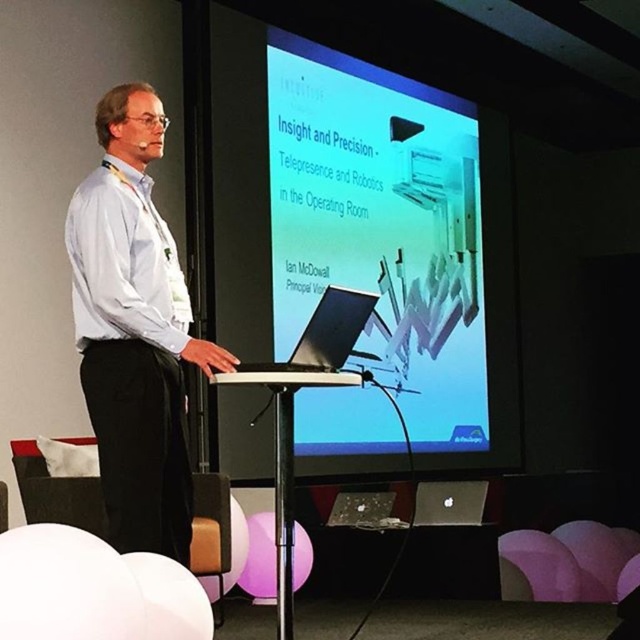
You are attending a conference and want to locate the presenter wearing the light blue shirt at center. Using the coordinate system where the bottom left corner is the origin, can you confirm if the point at coordinates (134, 330) corresponds to the location of the light blue shirt at center?

Yes, the light blue shirt at center is represented by point (134, 330), so the coordinates correspond to its location.

You are a photographer taking a picture of the presentation slide. You notice two points on the slide at coordinates point (349,250) and point (356,380). Which point is closer to the camera?

Point (356,380) is closer to the camera than point (349,250).

You are attending a conference and want to take a photo of the white glossy projector screen at upper center. However, the white plastic podium at center is blocking your view. Can you move to the side to get an unobstructed view of the screen?

The white glossy projector screen at upper center is above the white plastic podium at center, so moving to the side should allow you to see the screen over the podium.